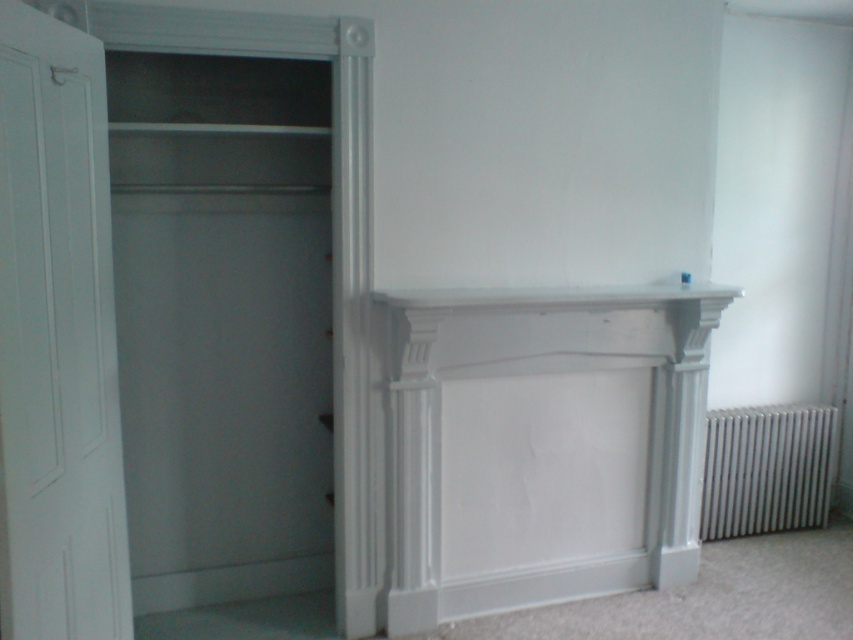
Question: Is white painted wood fireplace at center to the right of matte white closet at left from the viewer's perspective?

Choices:
 (A) yes
 (B) no

Answer: (A)

Question: Which object is closer to the camera taking this photo?

Choices:
 (A) white smooth mantle at center
 (B) matte white closet at left

Answer: (B)

Question: Which object appears farthest from the camera in this image?

Choices:
 (A) white painted wood fireplace at center
 (B) matte white closet at left
 (C) white smooth mantle at center

Answer: (A)

Question: Estimate the real-world distances between objects in this image. Which object is closer to the white painted wood fireplace at center?

Choices:
 (A) white smooth mantle at center
 (B) white metallic radiator at lower right

Answer: (A)

Question: In this image, where is white metallic radiator at lower right located relative to white smooth mantle at center?

Choices:
 (A) right
 (B) left

Answer: (A)

Question: Is white painted wood fireplace at center below white metallic radiator at lower right?

Choices:
 (A) no
 (B) yes

Answer: (A)